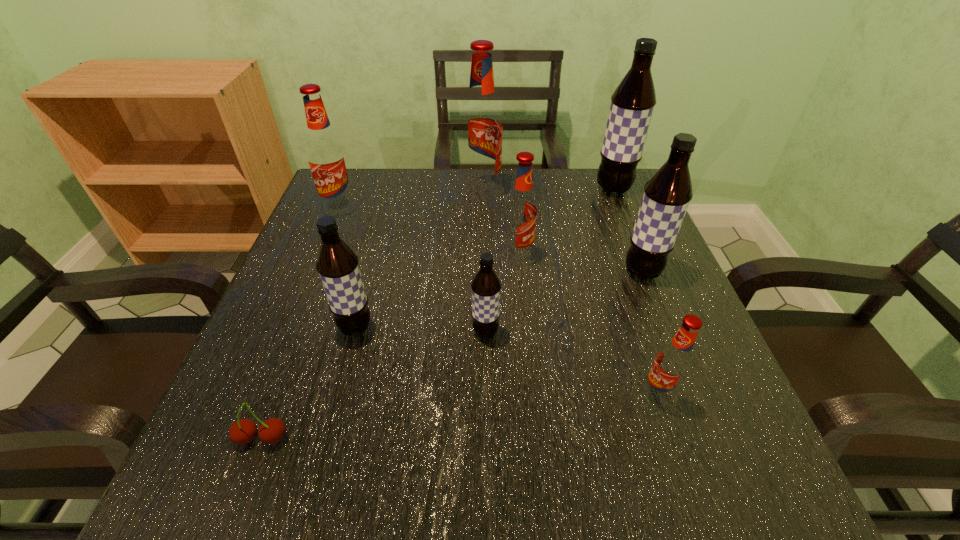
Identify the location of free spot at the far right corner of the desktop. (624, 209).

This screenshot has height=540, width=960. I want to click on blank area at the near right corner, so click(773, 477).

Find the location of `blank region between the biggest brown root beer and the smallest brown root beer`. blank region between the biggest brown root beer and the smallest brown root beer is located at coordinates [549, 261].

Find the location of `unoccupied area between the third brown root beer from right to left and the third biggest brown root beer`. unoccupied area between the third brown root beer from right to left and the third biggest brown root beer is located at coordinates (420, 330).

Where is `empty space that is in between the biggest brown root beer and the cherry`? empty space that is in between the biggest brown root beer and the cherry is located at coordinates (438, 314).

The width and height of the screenshot is (960, 540). What are the coordinates of `empty space that is in between the second biggest red root beer and the farthest brown root beer` in the screenshot? It's located at (476, 199).

Identify the location of free point between the smallest brown root beer and the biggest brown root beer. The height and width of the screenshot is (540, 960). (549, 261).

Find the location of `vacant space that's between the biggest brown root beer and the second smallest red root beer`. vacant space that's between the biggest brown root beer and the second smallest red root beer is located at coordinates (565, 222).

I want to click on empty space between the second nearest red root beer and the smallest brown root beer, so click(x=502, y=294).

Identify the location of free spot between the leftmost root beer and the biggest red root beer. The image size is (960, 540). click(411, 200).